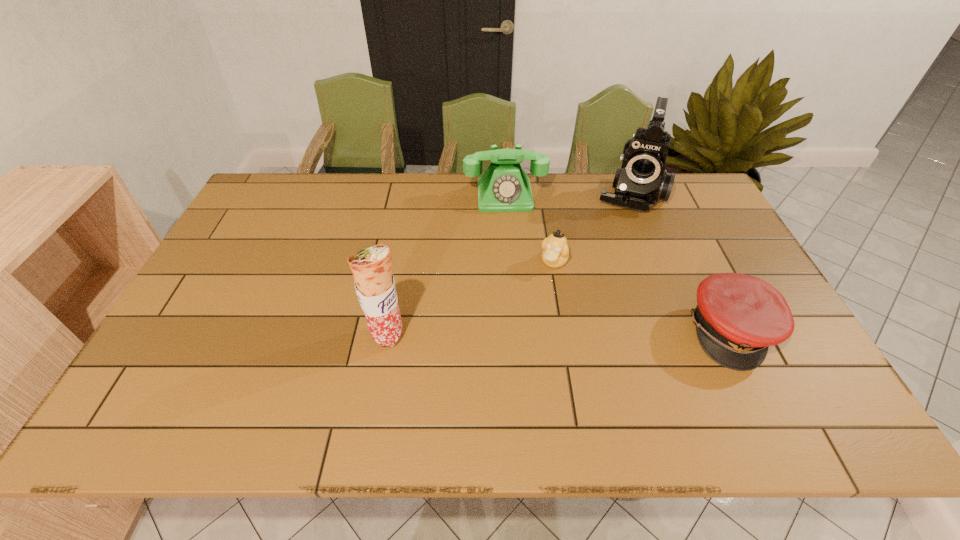
Locate an element on the screen. The height and width of the screenshot is (540, 960). empty space between the duckling and the burrito is located at coordinates [470, 299].

Locate an element on the screen. This screenshot has height=540, width=960. vacant area between the camcorder and the third tallest object is located at coordinates (567, 195).

This screenshot has height=540, width=960. I want to click on blank region between the camcorder and the third nearest object, so click(x=592, y=228).

Find the location of a particular element. The image size is (960, 540). unoccupied position between the camcorder and the third shortest object is located at coordinates (567, 195).

At what (x,y) coordinates should I click in order to perform the action: click on free space between the cap and the leftmost object. Please return your answer as a coordinate pair (x, y). The width and height of the screenshot is (960, 540). Looking at the image, I should click on (560, 333).

The height and width of the screenshot is (540, 960). What are the coordinates of `free space between the camcorder and the duckling` in the screenshot? It's located at (592, 228).

This screenshot has height=540, width=960. What are the coordinates of `free spot between the cap and the telephone` in the screenshot? It's located at (618, 264).

At what (x,y) coordinates should I click in order to perform the action: click on empty location between the cap and the burrito. Please return your answer as a coordinate pair (x, y). The width and height of the screenshot is (960, 540). Looking at the image, I should click on (560, 333).

Identify which object is the fourth nearest to the cap. Please provide its 2D coordinates. Your answer should be formatted as a tuple, i.e. [(x, y)], where the tuple contains the x and y coordinates of a point satisfying the conditions above.

[(374, 283)]

Locate an element on the screen. The image size is (960, 540). object that is the closest to the camcorder is located at coordinates (504, 187).